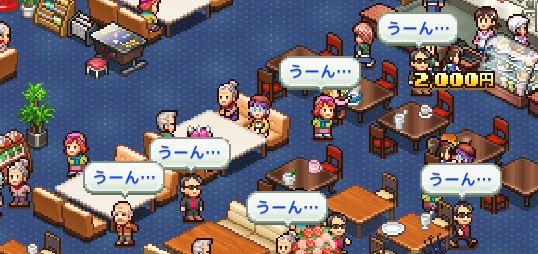
What are the coordinates of `blue carpet` in the screenshot? It's located at (166, 84).